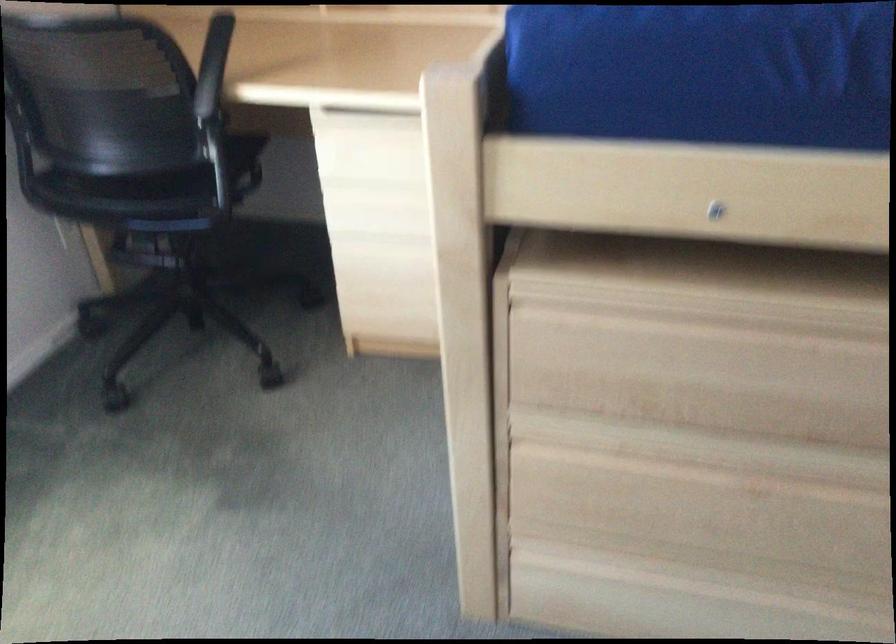
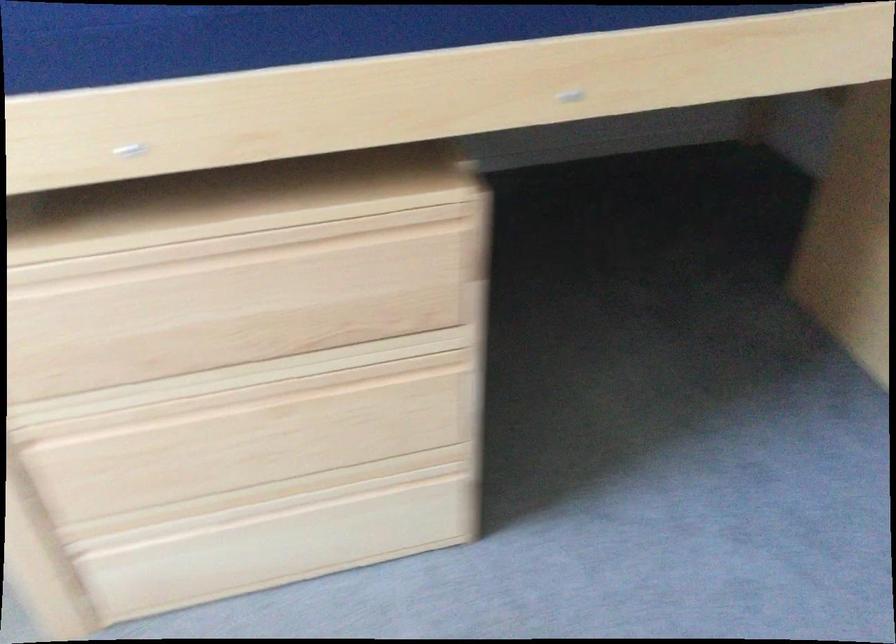
Question: The images are taken continuously from a first-person perspective. In which direction is your viewpoint rotating?

Choices:
 (A) Left
 (B) Right
 (C) Up
 (D) Down

Answer: (B)